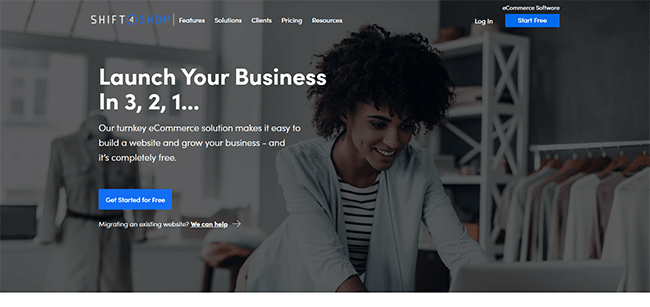
The image size is (650, 307). In order to click on hanger in this screenshot , I will do `click(640, 161)`, `click(618, 164)`, `click(602, 158)`, `click(584, 160)`, `click(571, 165)`, `click(554, 162)`, `click(545, 166)`.